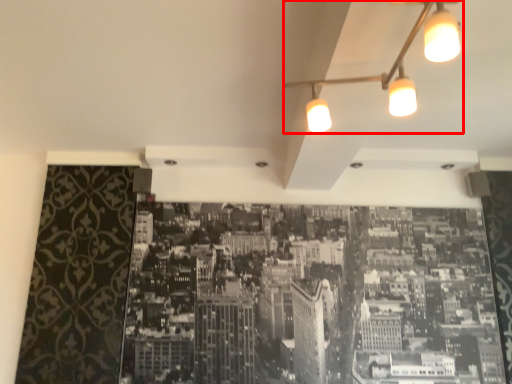
Question: From the image, what is the correct spatial relationship of lamp (annotated by the red box) in relation to hotel?

Choices:
 (A) right
 (B) left

Answer: (A)